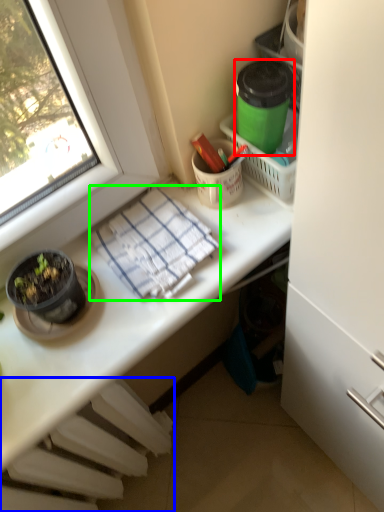
Question: Which object is the farthest from appliance (highlighted by a red box)? Choose among these: radiator (highlighted by a blue box) or blanket (highlighted by a green box).

Choices:
 (A) radiator
 (B) blanket

Answer: (A)